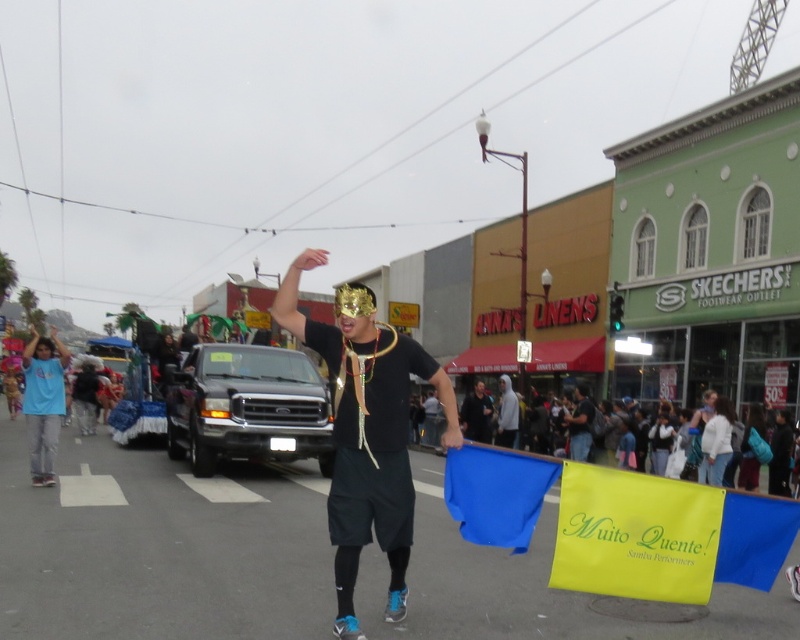
You are a photographer trying to capture a clear shot of both the black matte mask at center and the black fabric mask at center. Since they are both at the center, which one is more likely to be fully visible in your photo?

The black matte mask at center is larger in size than the black fabric mask at center, so the smaller black fabric mask at center is more likely to be fully visible in the photo.